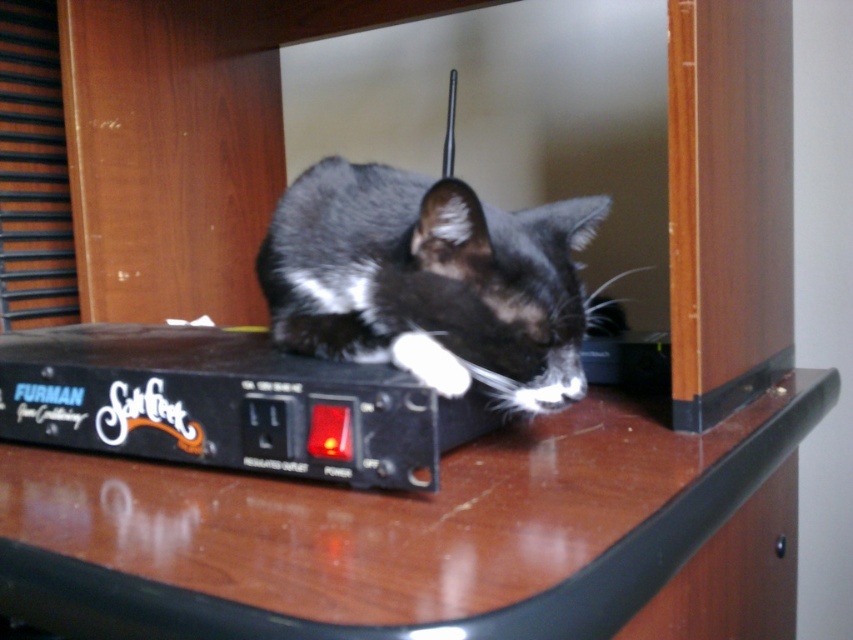
Based on the photo, please describe the position of the black fur cat at center in terms of coordinates based on the image frame. The image frame is considered as a coordinate system where the bottom left corner is the origin point. The x and y axes increase to the right and up respectively. The coordinates are normalized between 0 and 1. Please provide the coordinates as a tuple of two decimal numbers rounded to three decimal places.

The black fur cat at center is located at coordinates approximately equal to the 2D point given in the Objects Description, which is at point 0.439 in the x axis and 0.505 in the y axis. Therefore, the coordinates are approximately rounded to three decimal places as the tuple of two decimal numbers is 0.439 and 0.505.

You are a delivery person trying to place a small box on the brown glossy table at center. The box is 8 inches wide. Can you fit it on the table without overlapping the white fluffy paw at center?

The brown glossy table at center is 7.43 inches from white fluffy paw at center, so the 8 inch box would overlap the paw since the distance between them is less than the box width.

You are taking a photo of the black cat lying on the Furman Safefoot power conditioner. You notice two points marked in the image at coordinates point (703, 497) and point (270, 230). Which point is closer to the camera?

Point (703, 497) is closer to the camera than point (270, 230).